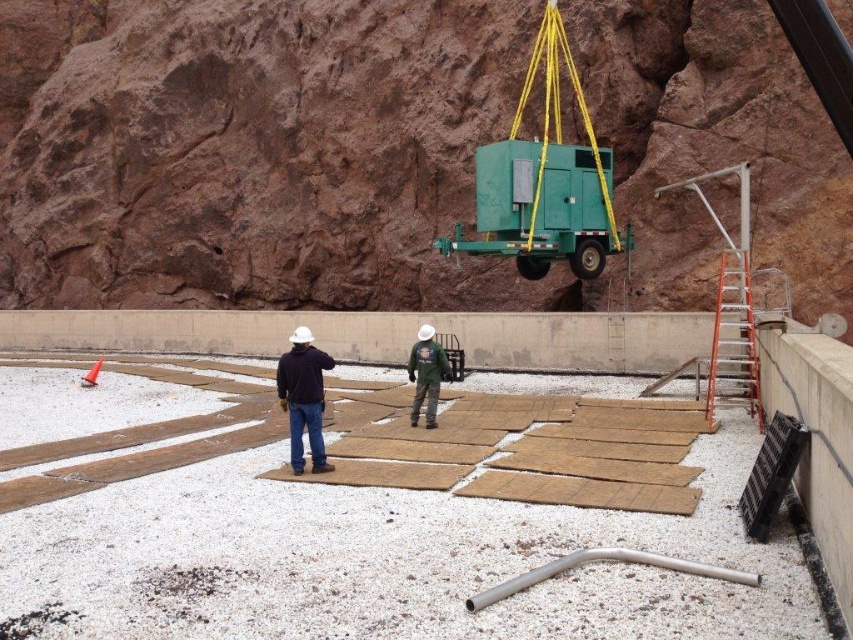
Is green matte trailer at upper center wider than matte black jacket at center?

Yes, green matte trailer at upper center is wider than matte black jacket at center.

Is green matte trailer at upper center taller than matte black jacket at center?

Yes, green matte trailer at upper center is taller than matte black jacket at center.

Image resolution: width=853 pixels, height=640 pixels. What are the coordinates of `green matte trailer at upper center` in the screenshot? It's located at (544, 180).

In the scene shown: Which is below, brown wood planks at center or matte black jacket at center?

brown wood planks at center

Can you confirm if brown wood planks at center is taller than matte black jacket at center?

Yes, brown wood planks at center is taller than matte black jacket at center.

What do you see at coordinates (369, 554) in the screenshot?
I see `brown wood planks at center` at bounding box center [369, 554].

The image size is (853, 640). In order to click on brown wood planks at center in this screenshot , I will do `click(369, 554)`.

How much distance is there between brown wood planks at center and green matte trailer at upper center?

26.92 feet

Is point (161, 518) positioned in front of point (595, 161)?

Yes, it is.

Where is `brown wood planks at center`? The width and height of the screenshot is (853, 640). brown wood planks at center is located at coordinates (369, 554).